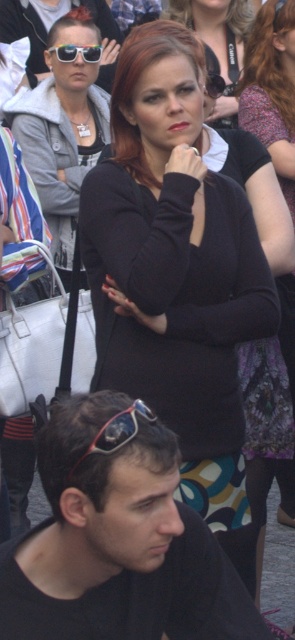
Is black matte dress at center positioned in front of matte black sunglasses at center?

Yes, black matte dress at center is in front of matte black sunglasses at center.

Does black matte dress at center have a larger size compared to matte black sunglasses at center?

Indeed, black matte dress at center has a larger size compared to matte black sunglasses at center.

The height and width of the screenshot is (640, 295). I want to click on black matte dress at center, so click(176, 275).

Is black matte sunglasses at lower left below red plastic sunglasses at lower left?

Indeed, black matte sunglasses at lower left is positioned under red plastic sunglasses at lower left.

Can you confirm if black matte sunglasses at lower left is wider than red plastic sunglasses at lower left?

Indeed, black matte sunglasses at lower left has a greater width compared to red plastic sunglasses at lower left.

Does point (146, 516) come closer to viewer compared to point (113, 417)?

That is True.

At what (x,y) coordinates should I click in order to perform the action: click on black matte sunglasses at lower left. Please return your answer as a coordinate pair (x, y). Looking at the image, I should click on (118, 540).

Can you confirm if matte black shirt at center is wider than matte black sunglasses at upper left?

No, matte black shirt at center is not wider than matte black sunglasses at upper left.

Who is positioned more to the right, matte black shirt at center or matte black sunglasses at upper left?

Positioned to the right is matte black shirt at center.

Find the location of a particular element. This screenshot has height=640, width=295. matte black shirt at center is located at coordinates (63, 131).

Identify the location of matte black shirt at center. The image size is (295, 640). (63, 131).